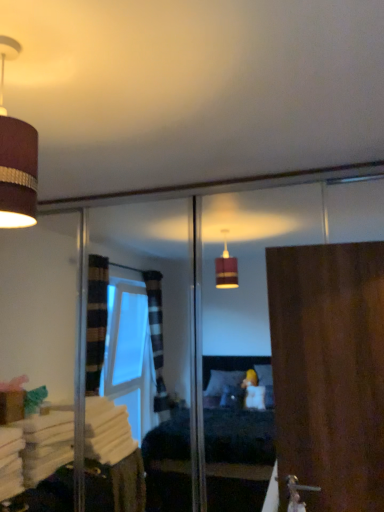
I want to click on vacant space situated above matte brown lampshade at upper left (from a real-world perspective), so coord(16,49).